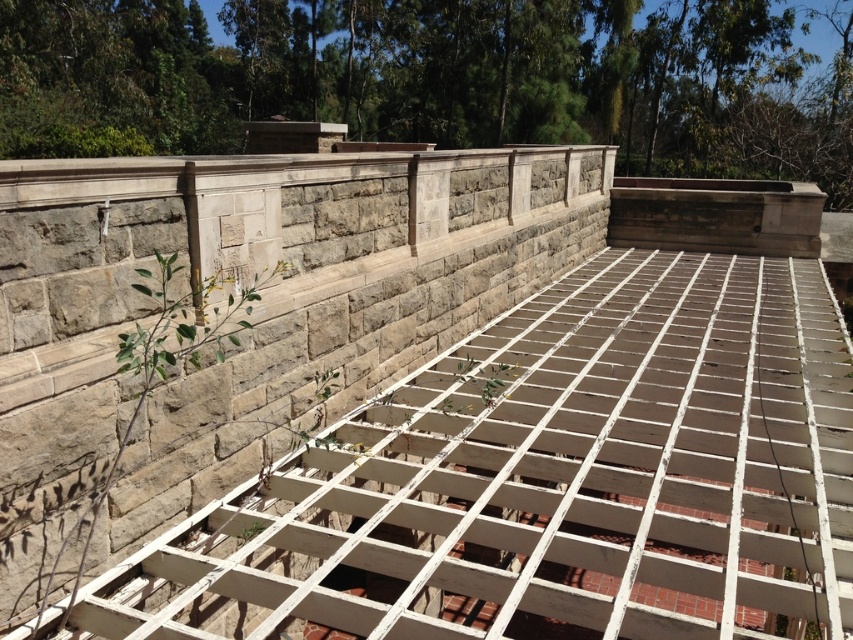
Is gray stone wall at upper center closer to the viewer compared to green leafy plant at left?

That is False.

Consider the image. Who is more distant from viewer, [363,195] or [55,560]?

The point [363,195] is behind.

Is point (548, 216) farther from viewer compared to point (138, 268)?

That is True.

The width and height of the screenshot is (853, 640). Find the location of `gray stone wall at upper center`. gray stone wall at upper center is located at coordinates (247, 317).